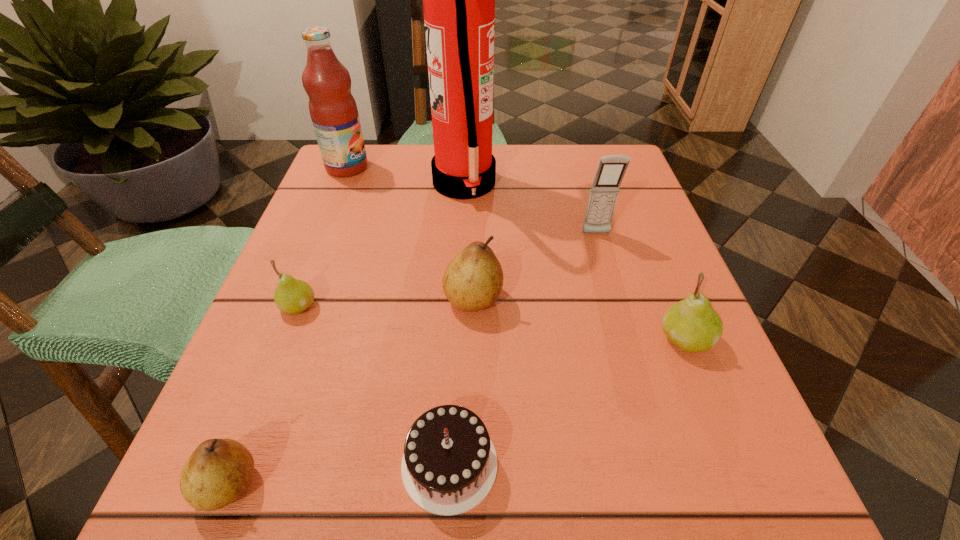
The width and height of the screenshot is (960, 540). What are the coordinates of `pear that is the second nearest to the chocolate cake` in the screenshot? It's located at (473, 280).

The width and height of the screenshot is (960, 540). I want to click on free space that satisfies the following two spatial constraints: 1. with the nozzle aimed from the tallest object; 2. on the left side of the rightmost pear, so click(x=457, y=339).

Locate an element on the screen. free space that satisfies the following two spatial constraints: 1. with the nozzle aimed from the fire extinguisher; 2. on the front side of the chocolate cake is located at coordinates (451, 464).

Locate an element on the screen. Image resolution: width=960 pixels, height=540 pixels. vacant region that satisfies the following two spatial constraints: 1. on the front-facing side of the second object from right to left; 2. on the left side of the rightmost pear is located at coordinates (627, 339).

Locate an element on the screen. Image resolution: width=960 pixels, height=540 pixels. vacant region that satisfies the following two spatial constraints: 1. on the back side of the bigger brown pear; 2. on the left side of the nearest pear is located at coordinates (300, 298).

Where is `vacant space that satisfies the following two spatial constraints: 1. on the front label of the seventh shortest object; 2. on the back side of the farther brown pear`? The width and height of the screenshot is (960, 540). vacant space that satisfies the following two spatial constraints: 1. on the front label of the seventh shortest object; 2. on the back side of the farther brown pear is located at coordinates (295, 298).